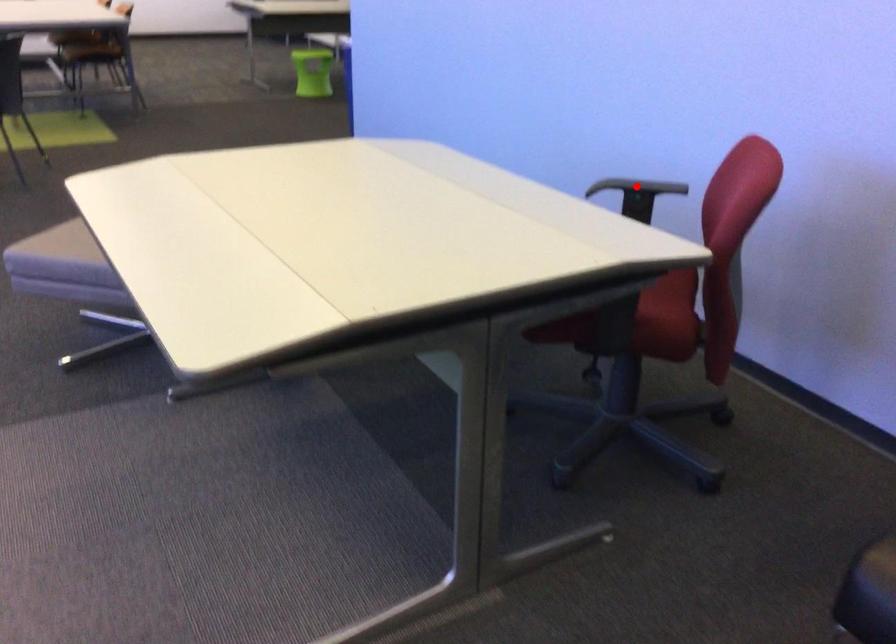
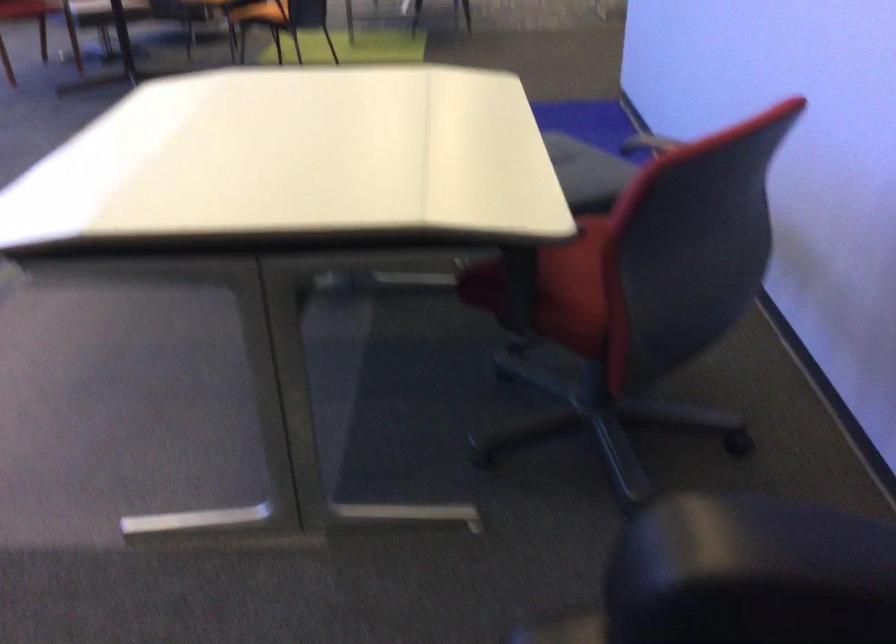
Question: I am providing you with two images of the same scene from different viewpoints. A red point is marked on the first image. Is the red point's position out of view in image 2?

Choices:
 (A) Yes
 (B) No

Answer: (A)